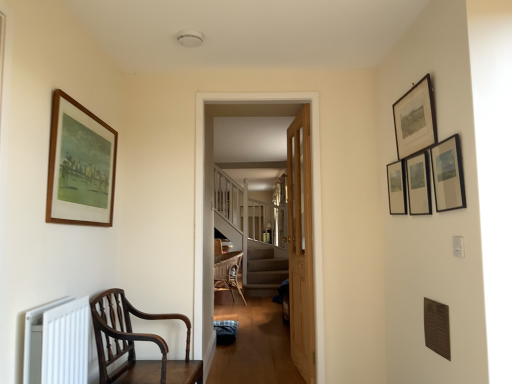
Question: Is point (420, 147) closer or farther from the camera than point (58, 337)?

Choices:
 (A) closer
 (B) farther

Answer: (B)

Question: Looking at their shapes, would you say wooden picture frame at upper right, the fourth picture frame when ordered from right to left, is wider or thinner than white matte radiator at lower left?

Choices:
 (A) thin
 (B) wide

Answer: (A)

Question: Which object is positioned closest to the matte black picture frame at upper right, which ranks as the third picture frame in left-to-right order?

Choices:
 (A) wooden door at center
 (B) wooden door at center
 (C) matte black picture frame at upper right, placed as the second picture frame when sorted from right to left
 (D) white matte radiator at lower left
 (E) mahogany wood chair at lower left

Answer: (C)

Question: Estimate the real-world distances between objects in this image. Which object is closer to the wooden picture frame at upper right, which is counted as the second picture frame, starting from the left?

Choices:
 (A) matte black picture frame at upper right, which ranks as the third picture frame in left-to-right order
 (B) wooden door at center
 (C) white matte radiator at lower left
 (D) matte black picture frame at upper right, placed as the fourth picture frame when sorted from left to right
 (E) wooden framed print at upper left, the first picture frame viewed from the left

Answer: (D)